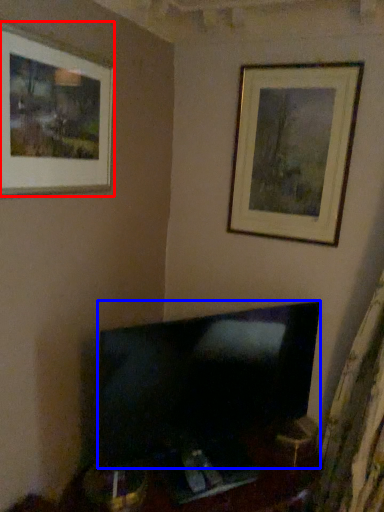
Question: Which object appears farthest to the camera in this image, picture frame (highlighted by a red box) or television (highlighted by a blue box)?

Choices:
 (A) picture frame
 (B) television

Answer: (B)